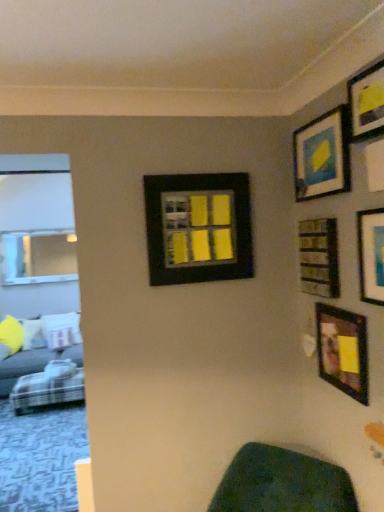
The width and height of the screenshot is (384, 512). Describe the element at coordinates (198, 228) in the screenshot. I see `black matte picture frame at center, which is counted as the sixth picture frame, starting from the right` at that location.

What is the approximate height of plush fabric couch at left?

plush fabric couch at left is 30.38 inches in height.

How much space does matte black picture frame at upper right, the 5th picture frame in the right-to-left sequence, occupy horizontally?

The width of matte black picture frame at upper right, the 5th picture frame in the right-to-left sequence, is 1.42 inches.

I want to click on black matte picture frame at center, the 1th picture frame in the left-to-right sequence, so click(198, 228).

Can you confirm if wooden frame at lower right, the 3th picture frame viewed from the right, is bigger than plush fabric couch at left?

No, wooden frame at lower right, the 3th picture frame viewed from the right, is not bigger than plush fabric couch at left.

Does wooden frame at lower right, the 3th picture frame viewed from the right, come in front of plush fabric couch at left?

Yes, wooden frame at lower right, the 3th picture frame viewed from the right, is closer to the viewer.

Is wooden frame at lower right, the 4th picture frame when ordered from left to right, not inside plush fabric couch at left?

wooden frame at lower right, the 4th picture frame when ordered from left to right, is positioned outside plush fabric couch at left.

Is wooden frame at lower right, the 3th picture frame viewed from the right, turned away from plush fabric couch at left?

No, wooden frame at lower right, the 3th picture frame viewed from the right, is not facing the opposite direction of plush fabric couch at left.

Is matte black picture frame at upper right, which appears as the second picture frame when viewed from the right, wider or thinner than matte black picture frame at upper right, the first picture frame when ordered from right to left?

matte black picture frame at upper right, which appears as the second picture frame when viewed from the right, is wider than matte black picture frame at upper right, the first picture frame when ordered from right to left.

You are a GUI agent. You are given a task and a screenshot of the screen. Output one action in this format:
    pyautogui.click(x=<x>, y=<y>)
    Task: Click on the picture frame on the right of matte black picture frame at upper right, placed as the fifth picture frame when sorted from left to right
    
    Given the screenshot: What is the action you would take?
    pyautogui.click(x=371, y=255)

Is matte black picture frame at upper right, placed as the fifth picture frame when sorted from left to right, oriented away from matte black picture frame at upper right, the first picture frame when ordered from right to left?

No, matte black picture frame at upper right, the first picture frame when ordered from right to left, is not at the back of matte black picture frame at upper right, placed as the fifth picture frame when sorted from left to right.

Can you tell me how much matte black picture frame at upper right, which appears as the second picture frame when viewed from the right, and matte black picture frame at upper right, which is the 6th picture frame in left-to-right order, differ in facing direction?

The angle between the facing direction of matte black picture frame at upper right, which appears as the second picture frame when viewed from the right, and the facing direction of matte black picture frame at upper right, which is the 6th picture frame in left-to-right order, is 0.546 degrees.

From a real-world perspective, between black matte picture frame at center, the 1th picture frame in the left-to-right sequence, and wooden frame at upper right, which ranks as the third picture frame in left-to-right order, who is vertically lower?

wooden frame at upper right, which ranks as the third picture frame in left-to-right order, is physically lower.

Between black matte picture frame at center, the 1th picture frame in the left-to-right sequence, and wooden frame at upper right, which ranks as the third picture frame in left-to-right order, which one is positioned behind?

black matte picture frame at center, the 1th picture frame in the left-to-right sequence, is further from the camera.

Is black matte picture frame at center, the 1th picture frame in the left-to-right sequence, wider than wooden frame at upper right, which ranks as the third picture frame in left-to-right order?

Indeed, black matte picture frame at center, the 1th picture frame in the left-to-right sequence, has a greater width compared to wooden frame at upper right, which ranks as the third picture frame in left-to-right order.

Can you confirm if black matte picture frame at center, which is counted as the sixth picture frame, starting from the right, is smaller than wooden frame at upper right, which is the fourth picture frame in right-to-left order?

Incorrect, black matte picture frame at center, which is counted as the sixth picture frame, starting from the right, is not smaller in size than wooden frame at upper right, which is the fourth picture frame in right-to-left order.

Based on the photo, is plush fabric couch at left shorter than matte black picture frame at upper right, placed as the fifth picture frame when sorted from left to right?

Incorrect, the height of plush fabric couch at left does not fall short of that of matte black picture frame at upper right, placed as the fifth picture frame when sorted from left to right.

Is plush fabric couch at left wider or thinner than matte black picture frame at upper right, placed as the fifth picture frame when sorted from left to right?

Clearly, plush fabric couch at left has more width compared to matte black picture frame at upper right, placed as the fifth picture frame when sorted from left to right.

Where is `studio couch to the left of matte black picture frame at upper right, placed as the fifth picture frame when sorted from left to right`? This screenshot has height=512, width=384. studio couch to the left of matte black picture frame at upper right, placed as the fifth picture frame when sorted from left to right is located at coordinates (32, 364).

From the image's perspective, would you say plush fabric couch at left is positioned over matte black picture frame at upper right, placed as the fifth picture frame when sorted from left to right?

No, from the image's perspective, plush fabric couch at left is not on top of matte black picture frame at upper right, placed as the fifth picture frame when sorted from left to right.

From a real-world perspective, is matte black picture frame at upper right, the 5th picture frame in the right-to-left sequence, over plush fabric couch at left?

Yes, from a real-world perspective, matte black picture frame at upper right, the 5th picture frame in the right-to-left sequence, is on top of plush fabric couch at left.

Which is closer to the camera, (321, 180) or (5, 397)?

Point (321, 180) is positioned closer to the camera compared to point (5, 397).

Could plush fabric couch at left be considered to be inside matte black picture frame at upper right, which is counted as the second picture frame, starting from the left?

No.

Considering the sizes of objects matte black picture frame at upper right, which is counted as the second picture frame, starting from the left, and plush fabric couch at left in the image provided, who is smaller, matte black picture frame at upper right, which is counted as the second picture frame, starting from the left, or plush fabric couch at left?

matte black picture frame at upper right, which is counted as the second picture frame, starting from the left.

Which picture frame is the 2nd one when counting from the right side of the plush fabric couch at left? Please provide its 2D coordinates.

[(322, 156)]

Does plush fabric couch at left come behind matte black picture frame at upper right, which is counted as the second picture frame, starting from the left?

Yes, it is behind matte black picture frame at upper right, which is counted as the second picture frame, starting from the left.

Considering the relative sizes of plush fabric couch at left and matte black picture frame at upper right, the 5th picture frame in the right-to-left sequence, in the image provided, is plush fabric couch at left bigger than matte black picture frame at upper right, the 5th picture frame in the right-to-left sequence,?

Yes.

Is plush fabric couch at left oriented towards matte black picture frame at upper right, the 5th picture frame in the right-to-left sequence?

No, plush fabric couch at left is not aimed at matte black picture frame at upper right, the 5th picture frame in the right-to-left sequence.

Which of these two, plaid fabric couch at lower left or black matte picture frame at center, the 1th picture frame in the left-to-right sequence, is thinner?

With smaller width is black matte picture frame at center, the 1th picture frame in the left-to-right sequence.

From the image's perspective, is plaid fabric couch at lower left under black matte picture frame at center, which is counted as the sixth picture frame, starting from the right?

Indeed, from the image's perspective, plaid fabric couch at lower left is shown beneath black matte picture frame at center, which is counted as the sixth picture frame, starting from the right.

In terms of height, does plaid fabric couch at lower left look taller or shorter compared to black matte picture frame at center, which is counted as the sixth picture frame, starting from the right?

Clearly, plaid fabric couch at lower left is shorter compared to black matte picture frame at center, which is counted as the sixth picture frame, starting from the right.

Which is more to the right, plaid fabric couch at lower left or black matte picture frame at center, which is counted as the sixth picture frame, starting from the right?

black matte picture frame at center, which is counted as the sixth picture frame, starting from the right, is more to the right.

This screenshot has width=384, height=512. In order to click on picture frame that is the 4th object to the right of the plush fabric couch at left, starting at the anchor in this screenshot , I will do `click(343, 350)`.

What are the coordinates of `picture frame located in front of the matte black picture frame at upper right, which appears as the second picture frame when viewed from the right` in the screenshot? It's located at (371, 255).

From the image, which object appears to be farther from plaid fabric couch at lower left, matte black picture frame at upper right, the 5th picture frame in the right-to-left sequence, or matte black picture frame at upper right, which is the 6th picture frame in left-to-right order?

The object further to plaid fabric couch at lower left is matte black picture frame at upper right, which is the 6th picture frame in left-to-right order.

Estimate the real-world distances between objects in this image. Which object is further from black matte picture frame at center, the 1th picture frame in the left-to-right sequence, plush fabric couch at left or wooden frame at upper right, which is the fourth picture frame in right-to-left order?

plush fabric couch at left lies further to black matte picture frame at center, the 1th picture frame in the left-to-right sequence, than the other object.

Looking at the image, which one is located closer to plaid fabric couch at lower left, matte black picture frame at upper right, placed as the fifth picture frame when sorted from left to right, or matte black picture frame at upper right, the first picture frame when ordered from right to left?

Among the two, matte black picture frame at upper right, the first picture frame when ordered from right to left, is located nearer to plaid fabric couch at lower left.

From the image, which object appears to be nearer to matte black picture frame at upper right, the first picture frame when ordered from right to left, matte black picture frame at upper right, which is counted as the second picture frame, starting from the left, or matte black picture frame at upper right, placed as the fifth picture frame when sorted from left to right?

The object closer to matte black picture frame at upper right, the first picture frame when ordered from right to left, is matte black picture frame at upper right, which is counted as the second picture frame, starting from the left.

Estimate the real-world distances between objects in this image. Which object is further from plaid fabric couch at lower left, black matte picture frame at center, the 1th picture frame in the left-to-right sequence, or matte black picture frame at upper right, which is counted as the second picture frame, starting from the left?

Based on the image, matte black picture frame at upper right, which is counted as the second picture frame, starting from the left, appears to be further to plaid fabric couch at lower left.

Considering their positions, is matte black picture frame at upper right, placed as the fifth picture frame when sorted from left to right, positioned further to wooden frame at lower right, the 3th picture frame viewed from the right, than plush fabric couch at left?

plush fabric couch at left lies further to wooden frame at lower right, the 3th picture frame viewed from the right, than the other object.

Considering their positions, is black matte picture frame at center, the 1th picture frame in the left-to-right sequence, positioned further to plush fabric couch at left than matte black picture frame at upper right, the 5th picture frame in the right-to-left sequence?

Among the two, matte black picture frame at upper right, the 5th picture frame in the right-to-left sequence, is located further to plush fabric couch at left.

Consider the image. Based on their spatial positions, is matte black picture frame at upper right, which is counted as the second picture frame, starting from the left, or matte black picture frame at upper right, the first picture frame when ordered from right to left, closer to matte black picture frame at upper right, placed as the fifth picture frame when sorted from left to right?

Based on the image, matte black picture frame at upper right, which is counted as the second picture frame, starting from the left, appears to be nearer to matte black picture frame at upper right, placed as the fifth picture frame when sorted from left to right.

The image size is (384, 512). In order to click on furniture positioned between matte black picture frame at upper right, the 5th picture frame in the right-to-left sequence, and plush fabric couch at left from near to far in this screenshot , I will do `click(49, 387)`.

The image size is (384, 512). I want to click on picture frame between wooden frame at upper right, which is the fourth picture frame in right-to-left order, and plaid fabric couch at lower left, along the z-axis, so (x=198, y=228).

The height and width of the screenshot is (512, 384). Find the location of `picture frame between black matte picture frame at center, which is counted as the sixth picture frame, starting from the right, and wooden frame at upper right, which is the fourth picture frame in right-to-left order, in the horizontal direction`. picture frame between black matte picture frame at center, which is counted as the sixth picture frame, starting from the right, and wooden frame at upper right, which is the fourth picture frame in right-to-left order, in the horizontal direction is located at coordinates click(x=322, y=156).

Find the location of `furniture between matte black picture frame at upper right, placed as the fifth picture frame when sorted from left to right, and plush fabric couch at left in the front-back direction`. furniture between matte black picture frame at upper right, placed as the fifth picture frame when sorted from left to right, and plush fabric couch at left in the front-back direction is located at coordinates (49, 387).